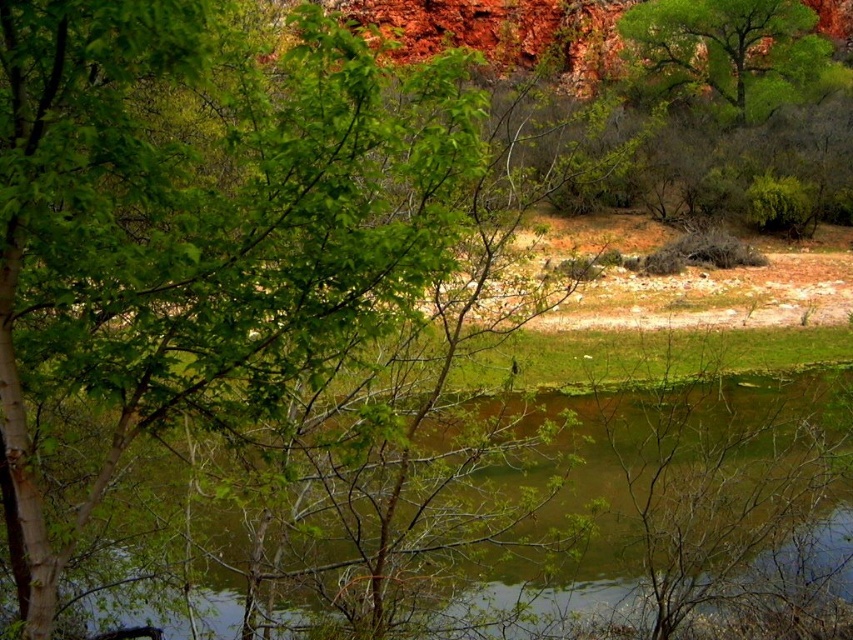
Question: Among these points, which one is farthest from the camera?

Choices:
 (A) (726, 22)
 (B) (635, 481)

Answer: (A)

Question: Is green murky water at center thinner than green leafy tree at upper right?

Choices:
 (A) no
 (B) yes

Answer: (B)

Question: Observing the image, what is the correct spatial positioning of green murky water at center in reference to green leafy tree at upper right?

Choices:
 (A) left
 (B) right

Answer: (A)

Question: Which object is farther from the camera taking this photo?

Choices:
 (A) green murky water at center
 (B) green leafy tree at upper right

Answer: (B)

Question: Is green murky water at center further to the viewer compared to green leafy tree at upper right?

Choices:
 (A) no
 (B) yes

Answer: (A)